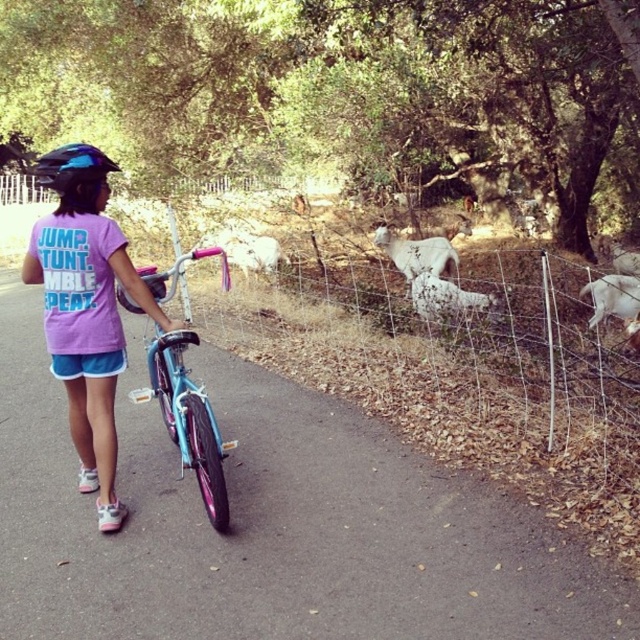
Question: Can you confirm if blue matte helmet at upper left is thinner than white woolly sheep at center?

Choices:
 (A) no
 (B) yes

Answer: (B)

Question: Is blue matte helmet at upper left thinner than white woolly sheep at right?

Choices:
 (A) yes
 (B) no

Answer: (A)

Question: Which point appears closest to the camera in this image?

Choices:
 (A) (129, 266)
 (B) (80, 157)
 (C) (628, 317)
 (D) (468, 307)

Answer: (B)

Question: Which object appears closest to the camera in this image?

Choices:
 (A) blue matte helmet at upper left
 (B) white woolly sheep at right
 (C) light blue matte bicycle at center
 (D) white woolen sheep at right

Answer: (C)

Question: Can you confirm if white woolen sheep at center is positioned above white woolly sheep at center?

Choices:
 (A) no
 (B) yes

Answer: (A)

Question: Estimate the real-world distances between objects in this image. Which object is closer to the white woolly sheep at center?

Choices:
 (A) light blue matte bicycle at center
 (B) blue matte helmet at upper left
 (C) white woolly sheep at right
 (D) pink fabric shirt at center

Answer: (C)